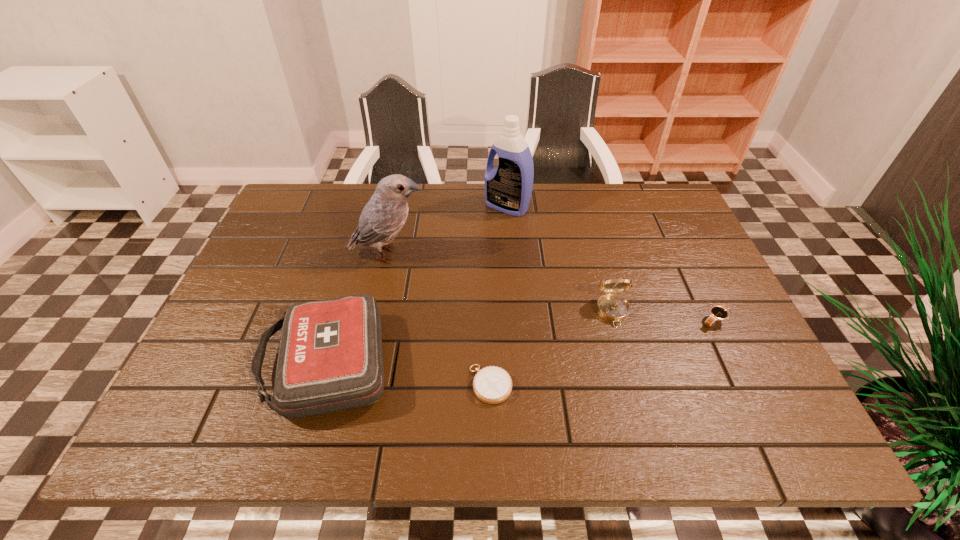
Locate an element on the screen. object positioned at the right edge is located at coordinates (717, 313).

The width and height of the screenshot is (960, 540). I want to click on object present at the near left corner, so click(330, 358).

This screenshot has width=960, height=540. In the image, there is a desktop. What are the coordinates of `free region at the far edge` in the screenshot? It's located at (477, 200).

The image size is (960, 540). I want to click on free space at the near edge, so click(x=698, y=406).

In order to click on blank area at the right edge in this screenshot , I will do `click(761, 384)`.

Find the location of a particular element. The image size is (960, 540). free space at the far left corner of the desktop is located at coordinates (282, 224).

At what (x,y) coordinates should I click in order to perform the action: click on vacant space at the far right corner of the desktop. Please return your answer as a coordinate pair (x, y). The width and height of the screenshot is (960, 540). Looking at the image, I should click on (659, 207).

Locate an element on the screen. vacant space at the near right corner is located at coordinates (734, 411).

Locate an element on the screen. free space between the shortest object and the second farthest object is located at coordinates (440, 319).

Where is `vacant region between the first-aid kit and the right compass`? The image size is (960, 540). vacant region between the first-aid kit and the right compass is located at coordinates (469, 338).